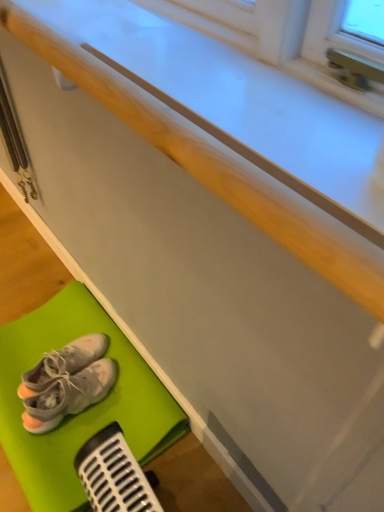
Question: Considering the relative positions of green rubber bath mat at lower left and white fabric sneakers at lower left, which appears as the 1th footwear when viewed from the top, in the image provided, is green rubber bath mat at lower left in front of white fabric sneakers at lower left, which appears as the 1th footwear when viewed from the top,?

Choices:
 (A) yes
 (B) no

Answer: (A)

Question: Is green rubber bath mat at lower left not near white fabric sneakers at lower left, placed as the 2th footwear when sorted from bottom to top?

Choices:
 (A) yes
 (B) no

Answer: (B)

Question: Is green rubber bath mat at lower left to the left of white fabric sneakers at lower left, placed as the 2th footwear when sorted from bottom to top, from the viewer's perspective?

Choices:
 (A) no
 (B) yes

Answer: (A)

Question: From the image's perspective, is green rubber bath mat at lower left located beneath white fabric sneakers at lower left, which appears as the 1th footwear when viewed from the top?

Choices:
 (A) yes
 (B) no

Answer: (A)

Question: Does green rubber bath mat at lower left have a lesser width compared to white fabric sneakers at lower left, placed as the 2th footwear when sorted from bottom to top?

Choices:
 (A) no
 (B) yes

Answer: (A)

Question: Considering the positions of white fabric sneakers at lower left, placed as the 2th footwear when sorted from bottom to top, and white fabric sneakers at lower left, which appears as the second footwear when viewed from the top, in the image, is white fabric sneakers at lower left, placed as the 2th footwear when sorted from bottom to top, wider or thinner than white fabric sneakers at lower left, which appears as the second footwear when viewed from the top,?

Choices:
 (A) thin
 (B) wide

Answer: (B)

Question: Considering the positions of point (34, 381) and point (86, 373), is point (34, 381) closer or farther from the camera than point (86, 373)?

Choices:
 (A) closer
 (B) farther

Answer: (A)

Question: From a real-world perspective, is white fabric sneakers at lower left, placed as the 2th footwear when sorted from bottom to top, above or below white fabric sneakers at lower left, which appears as the 1th footwear when ordered from the bottom?

Choices:
 (A) below
 (B) above

Answer: (B)

Question: From the image's perspective, is white fabric sneakers at lower left, placed as the 2th footwear when sorted from bottom to top, above or below white fabric sneakers at lower left, which appears as the second footwear when viewed from the top?

Choices:
 (A) above
 (B) below

Answer: (A)

Question: In terms of width, does green rubber bath mat at lower left look wider or thinner when compared to white fabric sneakers at lower left, which appears as the second footwear when viewed from the top?

Choices:
 (A) wide
 (B) thin

Answer: (A)

Question: Considering their positions, is green rubber bath mat at lower left located in front of or behind white fabric sneakers at lower left, which appears as the 1th footwear when ordered from the bottom?

Choices:
 (A) front
 (B) behind

Answer: (A)

Question: From the image's perspective, is green rubber bath mat at lower left located above or below white fabric sneakers at lower left, which appears as the 1th footwear when ordered from the bottom?

Choices:
 (A) above
 (B) below

Answer: (B)

Question: Choose the correct answer: Is green rubber bath mat at lower left inside white fabric sneakers at lower left, which appears as the 1th footwear when ordered from the bottom, or outside it?

Choices:
 (A) inside
 (B) outside

Answer: (B)

Question: Is point (64, 412) closer or farther from the camera than point (39, 368)?

Choices:
 (A) closer
 (B) farther

Answer: (A)

Question: In the image, is white fabric sneakers at lower left, which appears as the 1th footwear when ordered from the bottom, positioned in front of or behind white fabric sneakers at lower left, which appears as the 1th footwear when viewed from the top?

Choices:
 (A) behind
 (B) front

Answer: (B)